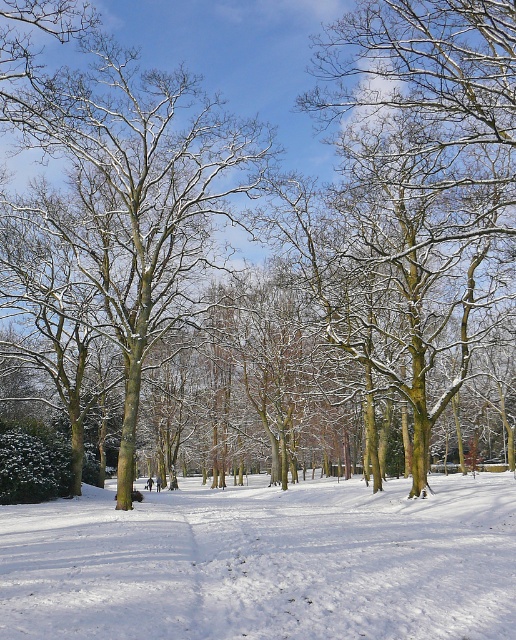
Question: Which object is closer to the camera taking this photo?

Choices:
 (A) snow-covered bark tree at center
 (B) white powdery snow at center

Answer: (B)

Question: Does white powdery snow at center have a smaller size compared to snow-covered bark tree at center?

Choices:
 (A) yes
 (B) no

Answer: (B)

Question: Can you confirm if white powdery snow at center is positioned to the right of snow-covered bark tree at center?

Choices:
 (A) no
 (B) yes

Answer: (B)

Question: Can you confirm if white powdery snow at center is wider than snow-covered bark tree at center?

Choices:
 (A) no
 (B) yes

Answer: (B)

Question: Which point is closer to the camera?

Choices:
 (A) (137, 324)
 (B) (362, 557)

Answer: (B)